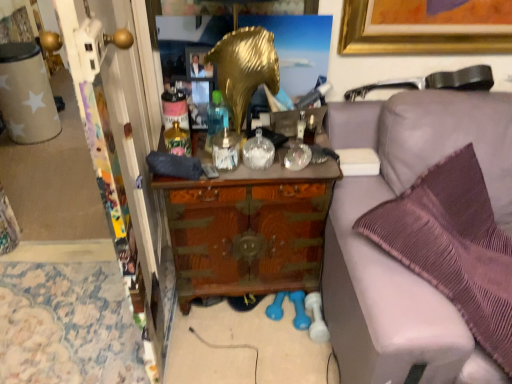
Question: From a real-world perspective, is gold metallic picture frame at upper center physically located above or below purple fabric couch at right?

Choices:
 (A) below
 (B) above

Answer: (B)

Question: Considering the positions of gold metallic picture frame at upper center and purple fabric couch at right in the image, is gold metallic picture frame at upper center taller or shorter than purple fabric couch at right?

Choices:
 (A) tall
 (B) short

Answer: (B)

Question: Estimate the real-world distances between objects in this image. Which object is farther from the beige paper cup at left?

Choices:
 (A) purple fabric couch at right
 (B) matte gray remote control at center
 (C) gold metallic picture frame at upper center
 (D) wooden chest at center

Answer: (A)

Question: Considering the real-world distances, which object is farthest from the purple fabric couch at right?

Choices:
 (A) beige paper cup at left
 (B) gold metallic picture frame at upper center
 (C) wooden chest at center
 (D) matte gray remote control at center

Answer: (A)